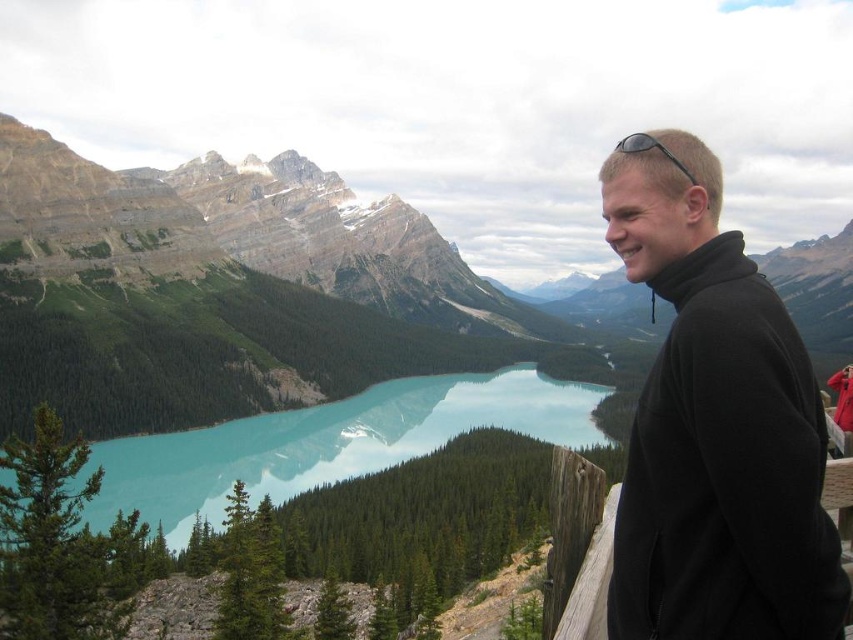
You are a photographer trying to capture a clear shot of the turquoise glossy water at center. However, there is a black fleece jacket at right in the frame. Based on their positions, can you adjust your angle to exclude the jacket while still including the water?

The black fleece jacket at right is in front of the turquoise glossy water at center, so you can move your camera position to the left to exclude the jacket while still capturing the water.

You are a photographer trying to capture the man in the black fleece jacket at right and the black rubber sunglasses at upper right in the same frame. Based on their positions, which object should you focus on first to ensure both are in the shot?

The black fleece jacket at right is positioned on the left side of black rubber sunglasses at upper right, so you should focus on the black fleece jacket at right first to ensure both are in the frame.